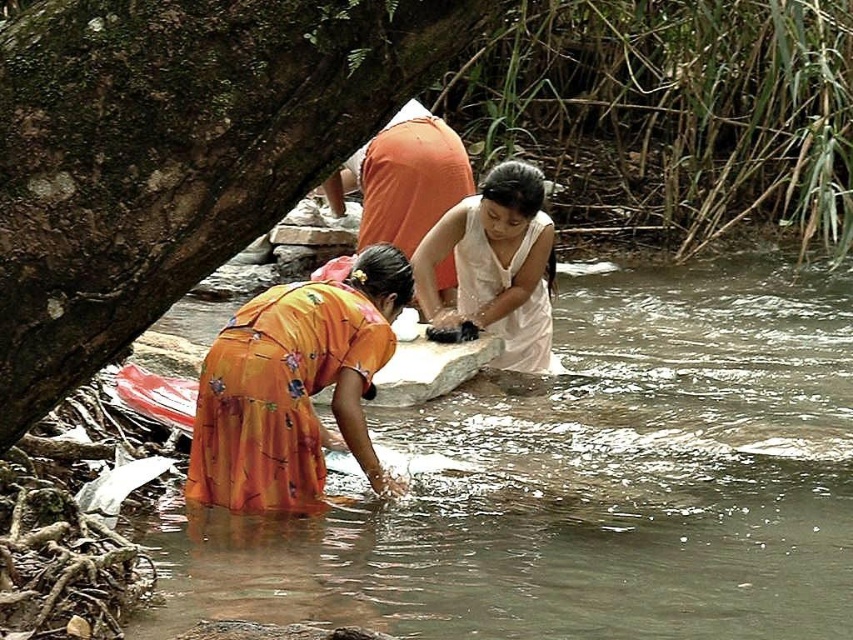
You are a traveler who needs to dry your clothes. You see a white matte cloth at center and an orange fabric at center. Which one is taller and can be used to hang higher?

The white matte cloth at center is taller than the orange fabric at center, so it can be used to hang higher.

You are standing at the edge of the stream and see the orange floral dress at lower left and the orange fabric at center. Which object is higher up in the scene?

The orange floral dress at lower left is much taller than the orange fabric at center, so it is higher up in the scene.

You are standing at the edge of the stream and see the orange floral dress at lower left and the white matte cloth at center. Which object is closer to your right side?

The white matte cloth at center is closer to your right side because the orange floral dress at lower left is to the left of it.